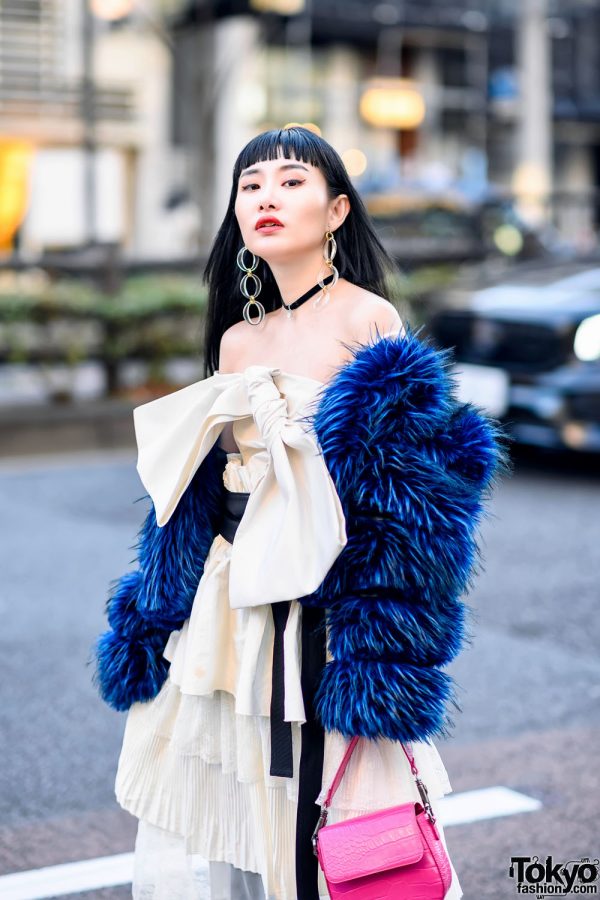
The width and height of the screenshot is (600, 900). What are the coordinates of `lights` in the screenshot? It's located at (379, 106), (15, 184).